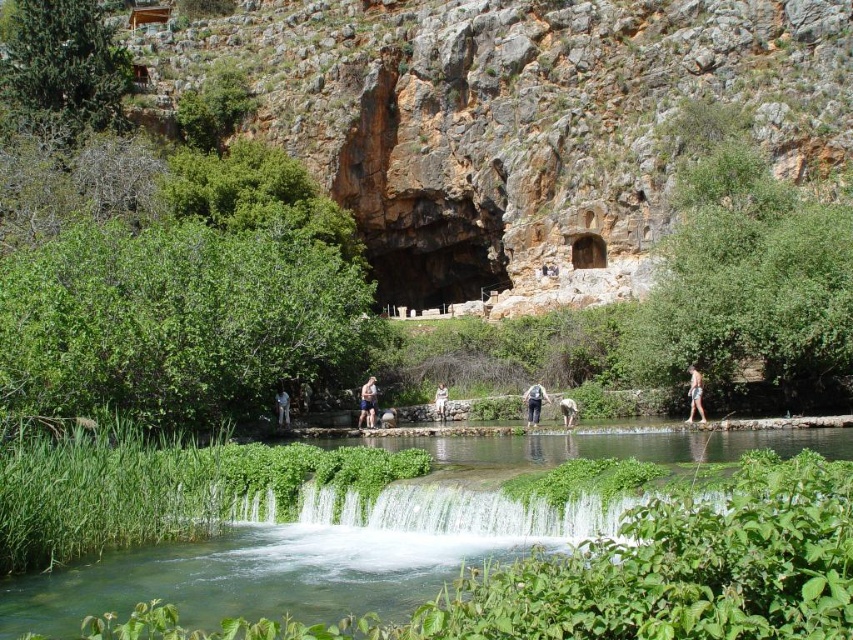
Can you confirm if clear water cascade at center is shorter than light brown leather backpack at center?

Incorrect, clear water cascade at center's height does not fall short of light brown leather backpack at center's.

Which of these two, clear water cascade at center or light brown leather backpack at center, stands shorter?

light brown leather backpack at center is shorter.

The height and width of the screenshot is (640, 853). What do you see at coordinates (465, 513) in the screenshot? I see `clear water cascade at center` at bounding box center [465, 513].

Where is `clear water cascade at center`? This screenshot has width=853, height=640. clear water cascade at center is located at coordinates (465, 513).

Is clear water cascade at center below matte gray backpack at center?

Correct, clear water cascade at center is located below matte gray backpack at center.

Between point (592, 531) and point (532, 417), which one is positioned behind?

Positioned behind is point (532, 417).

Where is `clear water cascade at center`? clear water cascade at center is located at coordinates (465, 513).

Locate an element on the screen. The image size is (853, 640). clear water cascade at center is located at coordinates (465, 513).

Does clear water cascade at center lie behind white cotton shirt at center?

That is False.

Who is more forward, (x=705, y=502) or (x=285, y=422)?

Point (x=705, y=502) is in front.

Which is in front, point (480, 531) or point (277, 404)?

Positioned in front is point (480, 531).

Locate an element on the screen. clear water cascade at center is located at coordinates (465, 513).